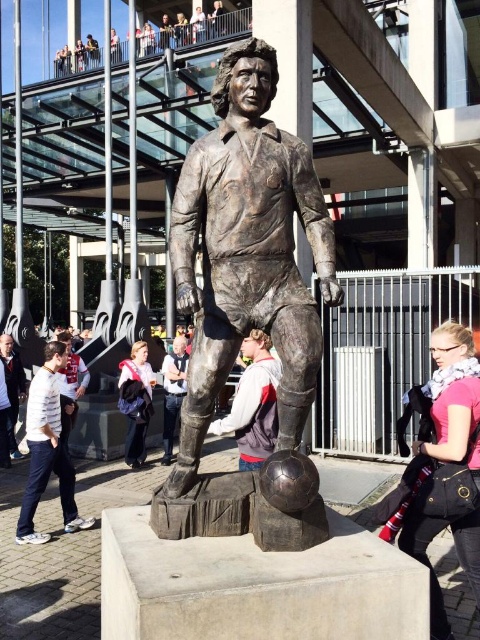
Can you confirm if white cotton shirt at lower left is positioned above bronze statue at lower left?

No.

Is white cotton shirt at lower left smaller than bronze statue at lower left?

Indeed, white cotton shirt at lower left has a smaller size compared to bronze statue at lower left.

Identify the location of white cotton shirt at lower left. (48, 451).

Can you confirm if gray hoodie at center is thinner than light brown leather jacket at center?

No.

Can you confirm if gray hoodie at center is shorter than light brown leather jacket at center?

Indeed, gray hoodie at center has a lesser height compared to light brown leather jacket at center.

You are a GUI agent. You are given a task and a screenshot of the screen. Output one action in this format:
    pyautogui.click(x=<x>, y=<y>)
    Task: Click on the gray hoodie at center
    This screenshot has height=640, width=480.
    Given the screenshot: What is the action you would take?
    pyautogui.click(x=253, y=403)

In the scene shown: Is bronze statue at center smaller than light brown hair at center?

No.

Looking at this image, is bronze statue at center to the left of light brown hair at center from the viewer's perspective?

No, bronze statue at center is not to the left of light brown hair at center.

Measure the distance between bronze statue at center and camera.

The distance of bronze statue at center from camera is 3.15 meters.

The width and height of the screenshot is (480, 640). I want to click on bronze statue at center, so click(245, 296).